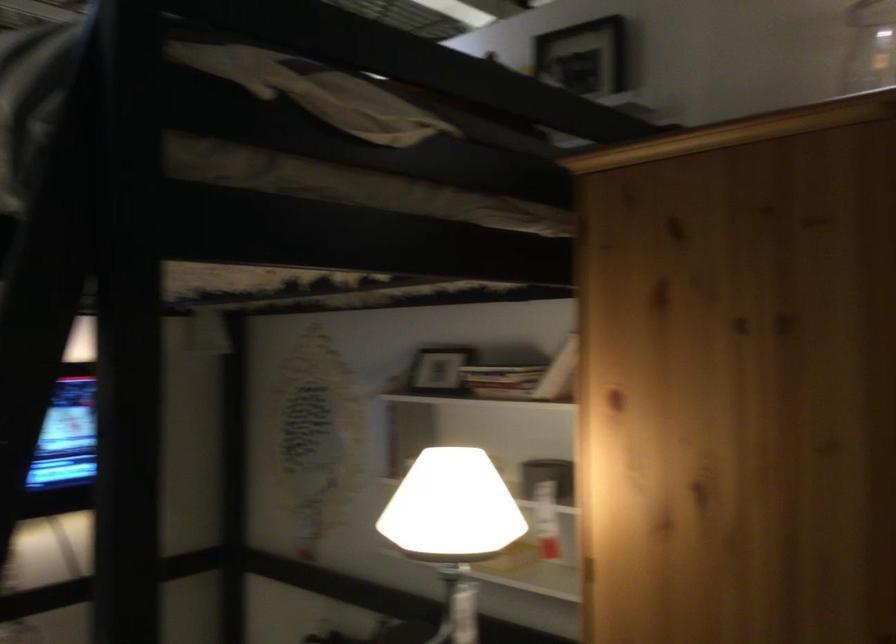
The width and height of the screenshot is (896, 644). Identify the location of white table lamp. (452, 525).